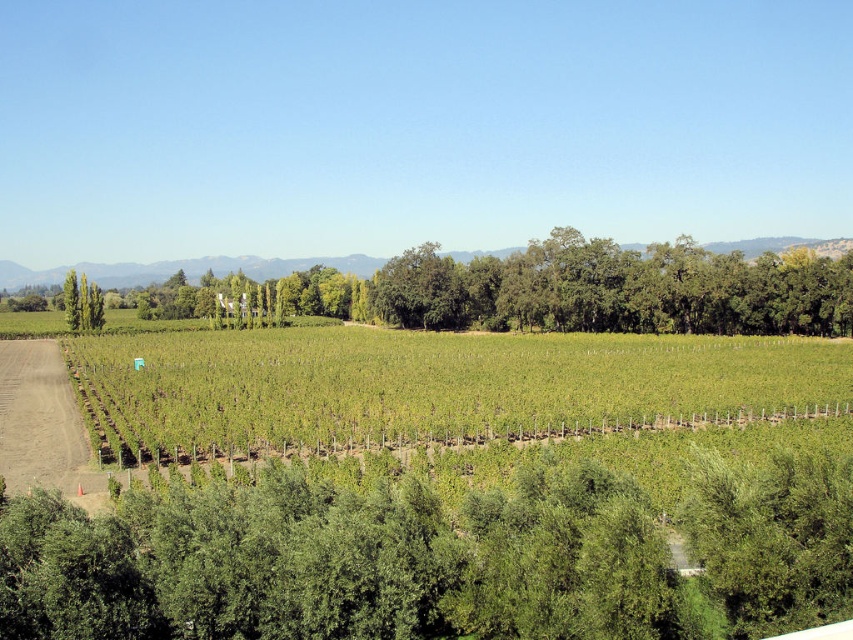
You are standing at the point marked by the coordinates point [434,557] in the vineyard scene. Which object is located exactly at this coordinate?

The green leafy tree at lower center is located exactly at point [434,557].

You are standing at the starting point of the dirt path in the vineyard. You see two points marked on the ground ahead of you. The first point is at coordinates point (x=548, y=493) and the second point is at point (x=537, y=356). Which point is closer to you as you face the direction of the path?

Point (x=548, y=493) is in front of point (x=537, y=356), so the first point is closer to you.

You are a landscape architect planning to install a small garden in the scene. You have two options for placement based on the available space. Which object, the green leafy tree at lower center or the green grassy field at center, would allow for a larger garden area?

The green grassy field at center has a greater width than the green leafy tree at lower center, so the green grassy field at center would allow for a larger garden area.